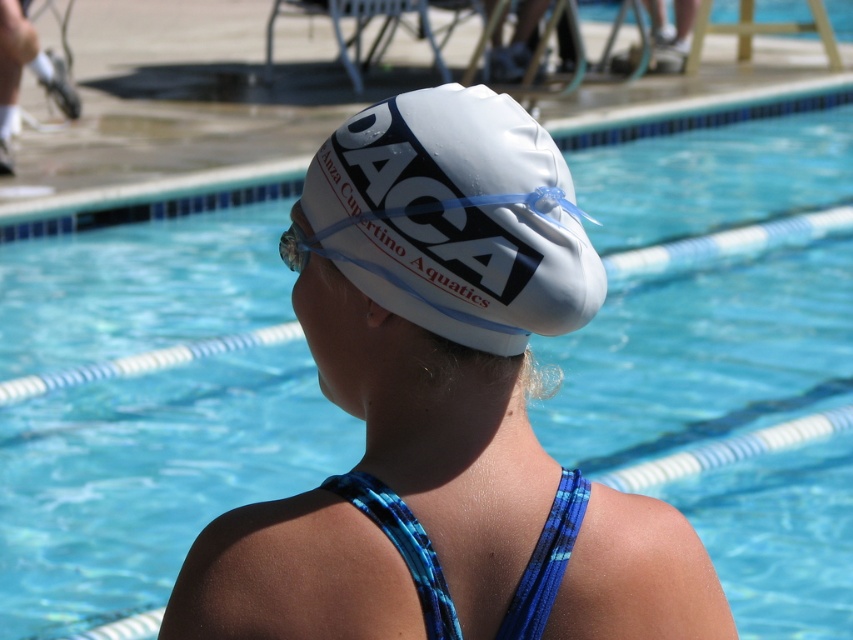
Consider the image. Is white matte swim cap at center to the left of clear plastic goggles at center from the viewer's perspective?

No, white matte swim cap at center is not to the left of clear plastic goggles at center.

Which is more to the left, white matte swim cap at center or clear plastic goggles at center?

clear plastic goggles at center is more to the left.

Between point (546, 323) and point (323, 253), which one is positioned in front?

Point (546, 323) is in front.

What are the coordinates of `white matte swim cap at center` in the screenshot? It's located at (456, 218).

Does blue woven strap at back appear over clear plastic goggles at center?

No, blue woven strap at back is not above clear plastic goggles at center.

Does blue woven strap at back have a greater height compared to clear plastic goggles at center?

Yes, blue woven strap at back is taller than clear plastic goggles at center.

Find the location of a particular element. The height and width of the screenshot is (640, 853). blue woven strap at back is located at coordinates click(x=403, y=545).

This screenshot has width=853, height=640. I want to click on blue woven strap at back, so click(x=403, y=545).

Is white matte swim cap at center above blue woven strap at back?

Yes, white matte swim cap at center is above blue woven strap at back.

Is point (440, 156) closer to camera compared to point (556, 552)?

No.

Is point (381, 259) positioned in front of point (540, 552)?

No, (381, 259) is behind (540, 552).

Image resolution: width=853 pixels, height=640 pixels. Identify the location of white matte swim cap at center. (456, 218).